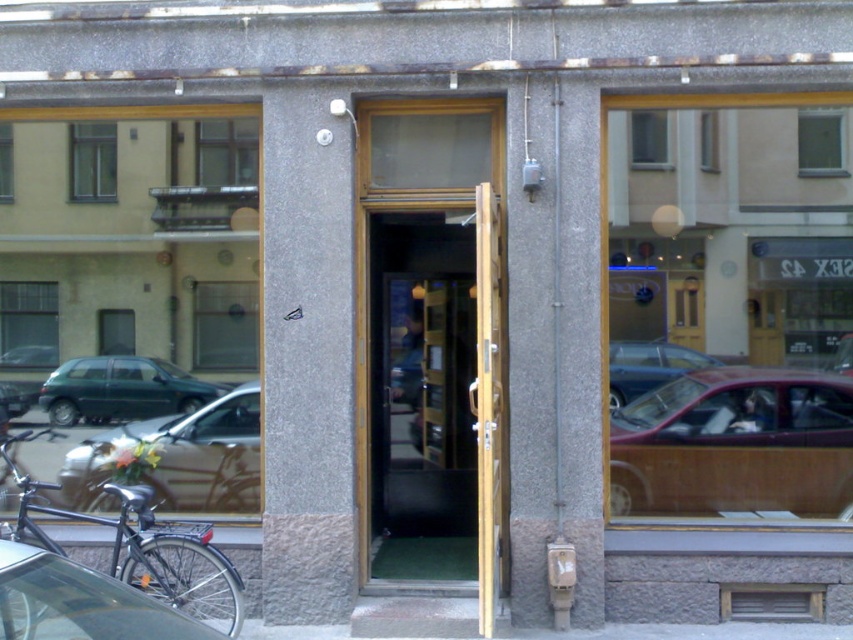
Question: Which of the following is the farthest from the observer?

Choices:
 (A) wooden panel car at center
 (B) metallic red car at center
 (C) green matte car at left
 (D) transparent wooden door at center

Answer: (C)

Question: Is metallic silver car at left smaller than green matte car at left?

Choices:
 (A) yes
 (B) no

Answer: (B)

Question: Can you confirm if metallic silver car at left is wider than metallic red car at center?

Choices:
 (A) no
 (B) yes

Answer: (B)

Question: Which point appears farthest from the camera in this image?

Choices:
 (A) (198, 410)
 (B) (672, 368)

Answer: (A)

Question: Estimate the real-world distances between objects in this image. Which object is closer to the black matte bicycle at left?

Choices:
 (A) metallic red car at center
 (B) metallic silver car at lower left

Answer: (A)

Question: Is wooden panel car at center positioned before metallic silver car at lower left?

Choices:
 (A) no
 (B) yes

Answer: (A)